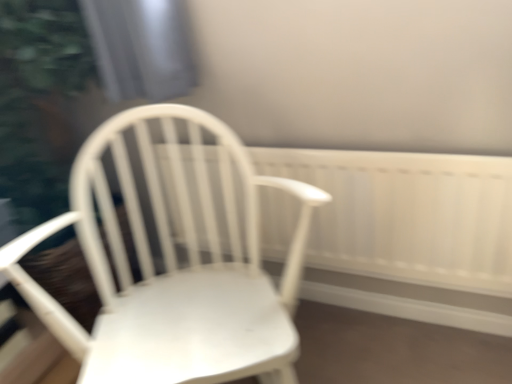
Describe the element at coordinates (173, 266) in the screenshot. I see `white matte wood chair at center` at that location.

Where is `white matte wood chair at center`? white matte wood chair at center is located at coordinates (173, 266).

What is the approximate height of white wooden radiator at center?

It is 43.14 centimeters.

What do you see at coordinates (407, 215) in the screenshot?
I see `white wooden radiator at center` at bounding box center [407, 215].

Image resolution: width=512 pixels, height=384 pixels. In order to click on white wooden radiator at center in this screenshot , I will do `click(407, 215)`.

Locate an element on the screen. white matte wood chair at center is located at coordinates (173, 266).

Visually, is white wooden radiator at center positioned to the left or to the right of white matte wood chair at center?

Based on their positions, white wooden radiator at center is located to the right of white matte wood chair at center.

From the picture: Is white wooden radiator at center further to camera compared to white matte wood chair at center?

Yes, white wooden radiator at center is further from the camera.

Is point (359, 232) positioned before point (101, 355)?

No, (359, 232) is further to viewer.

From the image's perspective, which one is positioned lower, white wooden radiator at center or white matte wood chair at center?

white matte wood chair at center appears lower in the image.

From a real-world perspective, between white wooden radiator at center and white matte wood chair at center, who is vertically lower?

From a 3D spatial view, white wooden radiator at center is below.

Does white wooden radiator at center have a lesser width compared to white matte wood chair at center?

Indeed, white wooden radiator at center has a lesser width compared to white matte wood chair at center.

Between white wooden radiator at center and white matte wood chair at center, which one has more height?

Standing taller between the two is white matte wood chair at center.

Based on their sizes in the image, would you say white wooden radiator at center is bigger or smaller than white matte wood chair at center?

Clearly, white wooden radiator at center is smaller in size than white matte wood chair at center.

Is white matte wood chair at center inside white wooden radiator at center?

No.

Does white wooden radiator at center touch white matte wood chair at center?

No, white wooden radiator at center is not with white matte wood chair at center.

Does white wooden radiator at center turn towards white matte wood chair at center?

Yes, white wooden radiator at center is facing white matte wood chair at center.

How different are the orientations of white wooden radiator at center and white matte wood chair at center in degrees?

33.4 degrees.

Locate an element on the screen. This screenshot has height=384, width=512. chair positioned vertically above the white wooden radiator at center (from a real-world perspective) is located at coordinates (173, 266).

Which object is positioned more to the left, white matte wood chair at center or white wooden radiator at center?

Positioned to the left is white matte wood chair at center.

Based on the photo, which object is closer to the camera, white matte wood chair at center or white wooden radiator at center?

white matte wood chair at center is in front.

Which is nearer, (196, 249) or (466, 196)?

Positioned in front is point (466, 196).

From the image's perspective, is white matte wood chair at center located above white wooden radiator at center?

Actually, white matte wood chair at center appears below white wooden radiator at center in the image.

From a real-world perspective, is white matte wood chair at center under white wooden radiator at center?

No, from a real-world perspective, white matte wood chair at center is not beneath white wooden radiator at center.

Which of these two, white matte wood chair at center or white wooden radiator at center, is wider?

white matte wood chair at center.

Considering the sizes of white matte wood chair at center and white wooden radiator at center in the image, is white matte wood chair at center taller or shorter than white wooden radiator at center?

Clearly, white matte wood chair at center is taller compared to white wooden radiator at center.

Which of these two, white matte wood chair at center or white wooden radiator at center, is bigger?

white matte wood chair at center is bigger.

In the scene shown: Does white matte wood chair at center contain white wooden radiator at center?

No, white matte wood chair at center does not contain white wooden radiator at center.

Based on the photo, is white matte wood chair at center placed right next to white wooden radiator at center?

No, white matte wood chair at center is not touching white wooden radiator at center.

Is white matte wood chair at center positioned with its back to white wooden radiator at center?

Yes, white matte wood chair at center's orientation is away from white wooden radiator at center.

The height and width of the screenshot is (384, 512). Identify the location of chair below the white wooden radiator at center (from the image's perspective). (173, 266).

You are a GUI agent. You are given a task and a screenshot of the screen. Output one action in this format:
    pyautogui.click(x=<x>, y=<y>)
    Task: Click on the radiator on the right side of white matte wood chair at center
    
    Given the screenshot: What is the action you would take?
    pyautogui.click(x=407, y=215)

At what (x,y) coordinates should I click in order to perform the action: click on chair below the white wooden radiator at center (from the image's perspective). Please return your answer as a coordinate pair (x, y). The width and height of the screenshot is (512, 384). Looking at the image, I should click on (173, 266).